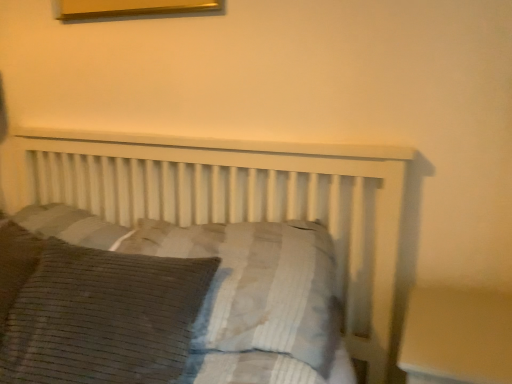
Question: Considering the relative sizes of brown corduroy pillow at center, the second pillow positioned from the left, and brown corduroy pillow at lower left, marked as the 2th pillow in a right-to-left arrangement, in the image provided, is brown corduroy pillow at center, the second pillow positioned from the left, thinner than brown corduroy pillow at lower left, marked as the 2th pillow in a right-to-left arrangement,?

Choices:
 (A) no
 (B) yes

Answer: (A)

Question: Can you confirm if brown corduroy pillow at center, the second pillow positioned from the left, is bigger than brown corduroy pillow at lower left, marked as the 2th pillow in a right-to-left arrangement?

Choices:
 (A) no
 (B) yes

Answer: (B)

Question: Can you confirm if brown corduroy pillow at center, which is the 1th pillow in right-to-left order, is taller than brown corduroy pillow at lower left, marked as the 2th pillow in a right-to-left arrangement?

Choices:
 (A) no
 (B) yes

Answer: (A)

Question: Is brown corduroy pillow at center, which is the 1th pillow in right-to-left order, facing away from brown corduroy pillow at lower left, the 1th pillow in the left-to-right sequence?

Choices:
 (A) yes
 (B) no

Answer: (B)

Question: Does brown corduroy pillow at center, which is the 1th pillow in right-to-left order, appear on the right side of brown corduroy pillow at lower left, marked as the 2th pillow in a right-to-left arrangement?

Choices:
 (A) no
 (B) yes

Answer: (B)

Question: Is brown corduroy pillow at center, the second pillow positioned from the left, beside brown corduroy pillow at lower left, the 1th pillow in the left-to-right sequence?

Choices:
 (A) yes
 (B) no

Answer: (B)

Question: Does brown corduroy pillow at lower left, marked as the 2th pillow in a right-to-left arrangement, have a lesser width compared to brown corduroy pillow at center, the second pillow positioned from the left?

Choices:
 (A) no
 (B) yes

Answer: (B)

Question: Can you confirm if brown corduroy pillow at lower left, marked as the 2th pillow in a right-to-left arrangement, is wider than brown corduroy pillow at center, which is the 1th pillow in right-to-left order?

Choices:
 (A) no
 (B) yes

Answer: (A)

Question: Are brown corduroy pillow at lower left, the 1th pillow in the left-to-right sequence, and brown corduroy pillow at center, which is the 1th pillow in right-to-left order, beside each other?

Choices:
 (A) yes
 (B) no

Answer: (B)

Question: Is brown corduroy pillow at lower left, the 1th pillow in the left-to-right sequence, not close to brown corduroy pillow at center, which is the 1th pillow in right-to-left order?

Choices:
 (A) yes
 (B) no

Answer: (B)

Question: Is brown corduroy pillow at lower left, the 1th pillow in the left-to-right sequence, behind brown corduroy pillow at center, the second pillow positioned from the left?

Choices:
 (A) yes
 (B) no

Answer: (B)

Question: From the image's perspective, is brown corduroy pillow at lower left, the 1th pillow in the left-to-right sequence, located beneath brown corduroy pillow at center, the second pillow positioned from the left?

Choices:
 (A) no
 (B) yes

Answer: (B)

Question: Looking at their shapes, would you say brown corduroy pillow at center, which is the 1th pillow in right-to-left order, is wider or thinner than brown corduroy pillow at lower left, the 1th pillow in the left-to-right sequence?

Choices:
 (A) thin
 (B) wide

Answer: (B)